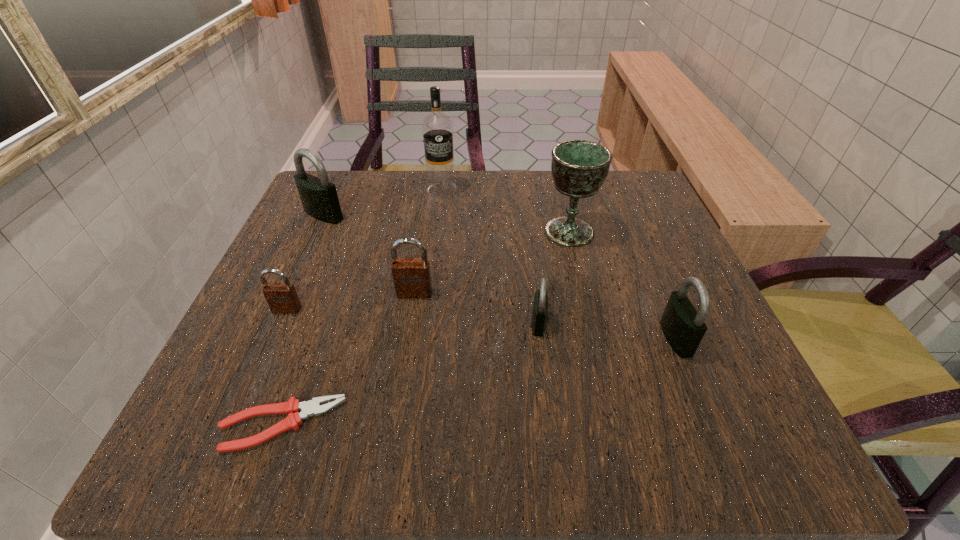
Identify the location of object that is at the far left corner. (319, 198).

Find the location of `object that is at the near left corner`. object that is at the near left corner is located at coordinates (292, 407).

Identify the location of object located at the far right corner. (579, 167).

The height and width of the screenshot is (540, 960). I want to click on blank space at the far edge of the desktop, so click(523, 213).

This screenshot has height=540, width=960. I want to click on blank area at the near edge, so click(526, 459).

This screenshot has height=540, width=960. What are the coordinates of `vacant space at the left edge` in the screenshot? It's located at (302, 237).

You are a GUI agent. You are given a task and a screenshot of the screen. Output one action in this format:
    pyautogui.click(x=<x>, y=<y>)
    Task: Click on the free space at the right edge
    The height and width of the screenshot is (540, 960).
    Given the screenshot: What is the action you would take?
    pyautogui.click(x=708, y=363)

Locate an element on the screen. Image resolution: width=960 pixels, height=540 pixels. vacant space at the near left corner of the desktop is located at coordinates (254, 428).

Locate an element on the screen. Image resolution: width=960 pixels, height=540 pixels. vacant space at the far right corner of the desktop is located at coordinates (652, 225).

You are a GUI agent. You are given a task and a screenshot of the screen. Output one action in this format:
    pyautogui.click(x=<x>, y=<y>)
    Task: Click on the free spot between the smaller brown padlock and the farthest object
    
    Given the screenshot: What is the action you would take?
    pyautogui.click(x=364, y=249)